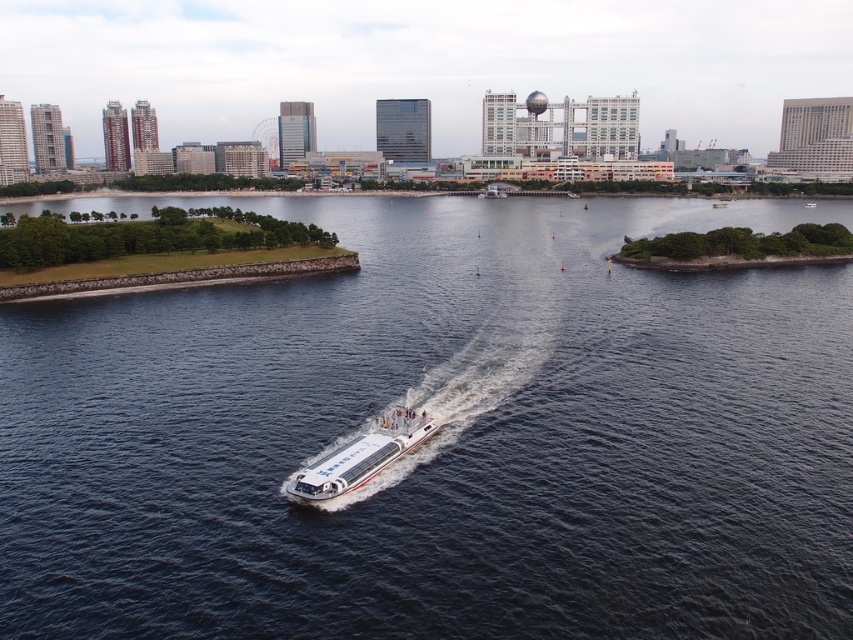
Question: Does dark blue water at center come behind white glossy boat at center?

Choices:
 (A) no
 (B) yes

Answer: (A)

Question: Which point appears farthest from the camera in this image?

Choices:
 (A) (368, 435)
 (B) (550, 280)

Answer: (B)

Question: Is dark blue water at center wider than white glossy boat at center?

Choices:
 (A) no
 (B) yes

Answer: (B)

Question: Which of the following is the closest to the observer?

Choices:
 (A) dark blue water at center
 (B) white glossy boat at center

Answer: (A)

Question: Is dark blue water at center to the left of white glossy boat at center from the viewer's perspective?

Choices:
 (A) yes
 (B) no

Answer: (B)